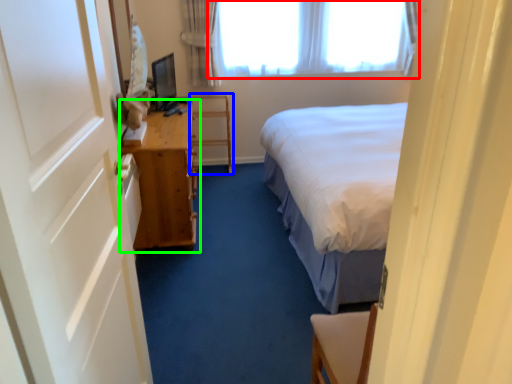
Question: Considering the real-world distances, which object is farthest from window (highlighted by a red box)? furniture (highlighted by a blue box) or table (highlighted by a green box)?

Choices:
 (A) furniture
 (B) table

Answer: (B)